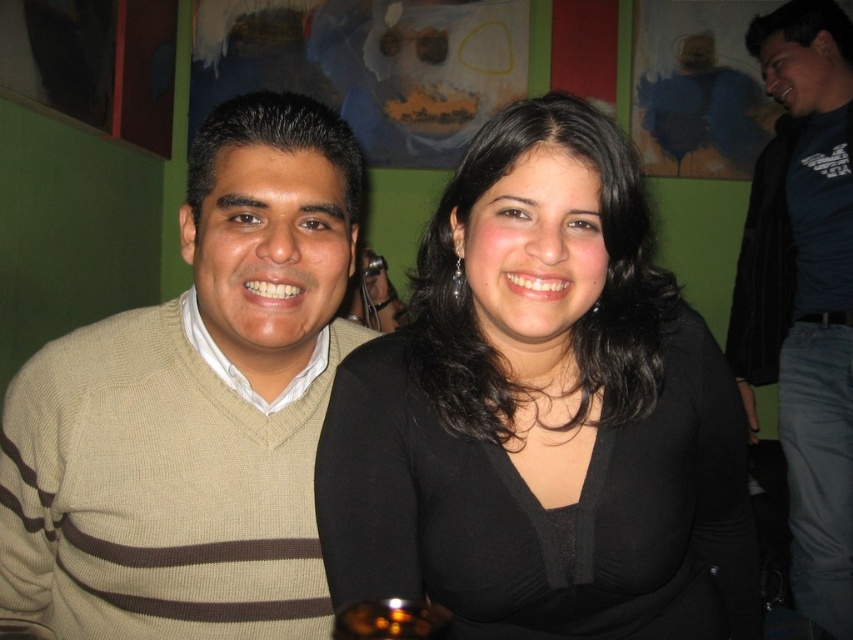
Is beige striped sweater at left taller than dark blue shirt at right?

In fact, beige striped sweater at left may be shorter than dark blue shirt at right.

Is point (251, 172) positioned before point (792, 580)?

Yes.

I want to click on beige striped sweater at left, so click(195, 406).

Which is above, black matte shirt at center or beige striped sweater at left?

beige striped sweater at left is higher up.

Is black matte shirt at center positioned in front of beige striped sweater at left?

Yes, it is.

Identify the location of black matte shirt at center. The image size is (853, 640). (543, 413).

Does black matte shirt at center have a larger size compared to dark blue shirt at right?

Incorrect, black matte shirt at center is not larger than dark blue shirt at right.

Between black matte shirt at center and dark blue shirt at right, which one has less height?

black matte shirt at center is shorter.

Between point (587, 305) and point (804, 54), which one is positioned in front?

Point (587, 305) is more forward.

Find the location of a particular element. Image resolution: width=853 pixels, height=640 pixels. black matte shirt at center is located at coordinates (543, 413).